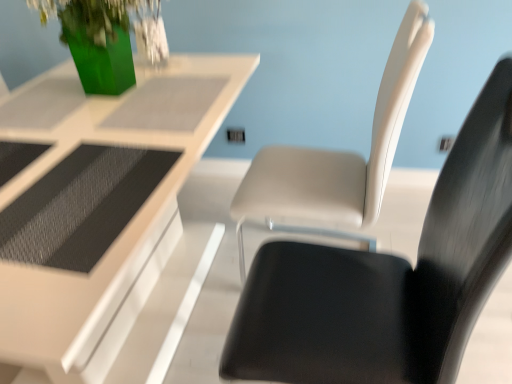
Question: From a real-world perspective, is matte white chair at center, positioned as the first chair in front-to-back order, positioned under white glossy table at upper center based on gravity?

Choices:
 (A) yes
 (B) no

Answer: (B)

Question: From a real-world perspective, is matte white chair at center, positioned as the second chair in back-to-front order, on top of white glossy table at upper center?

Choices:
 (A) yes
 (B) no

Answer: (A)

Question: Can you confirm if matte white chair at center, positioned as the first chair in front-to-back order, is bigger than white glossy table at upper center?

Choices:
 (A) yes
 (B) no

Answer: (B)

Question: From the image's perspective, is matte white chair at center, positioned as the second chair in back-to-front order, below white glossy table at upper center?

Choices:
 (A) no
 (B) yes

Answer: (B)

Question: Can you confirm if matte white chair at center, positioned as the first chair in front-to-back order, is smaller than white glossy table at upper center?

Choices:
 (A) yes
 (B) no

Answer: (A)

Question: Can you see matte white chair at center, positioned as the first chair in front-to-back order, touching white glossy table at upper center?

Choices:
 (A) no
 (B) yes

Answer: (A)

Question: Does white glossy table at upper center have a lesser height compared to matte white chair at center, positioned as the first chair in front-to-back order?

Choices:
 (A) no
 (B) yes

Answer: (B)

Question: Is white glossy table at upper center wider than matte white chair at center, positioned as the first chair in front-to-back order?

Choices:
 (A) yes
 (B) no

Answer: (A)

Question: From a real-world perspective, is white glossy table at upper center below matte white chair at center, positioned as the second chair in back-to-front order?

Choices:
 (A) no
 (B) yes

Answer: (B)

Question: From the image's perspective, is white glossy table at upper center located above matte white chair at center, positioned as the first chair in front-to-back order?

Choices:
 (A) yes
 (B) no

Answer: (A)

Question: Is matte white chair at center, positioned as the second chair in back-to-front order, completely or partially inside white glossy table at upper center?

Choices:
 (A) yes
 (B) no

Answer: (B)

Question: Is white glossy table at upper center at the right side of matte white chair at center, positioned as the first chair in front-to-back order?

Choices:
 (A) yes
 (B) no

Answer: (B)

Question: Does matte white chair at center, acting as the 2th chair starting from the front, have a smaller size compared to matte white chair at center, positioned as the second chair in back-to-front order?

Choices:
 (A) no
 (B) yes

Answer: (A)